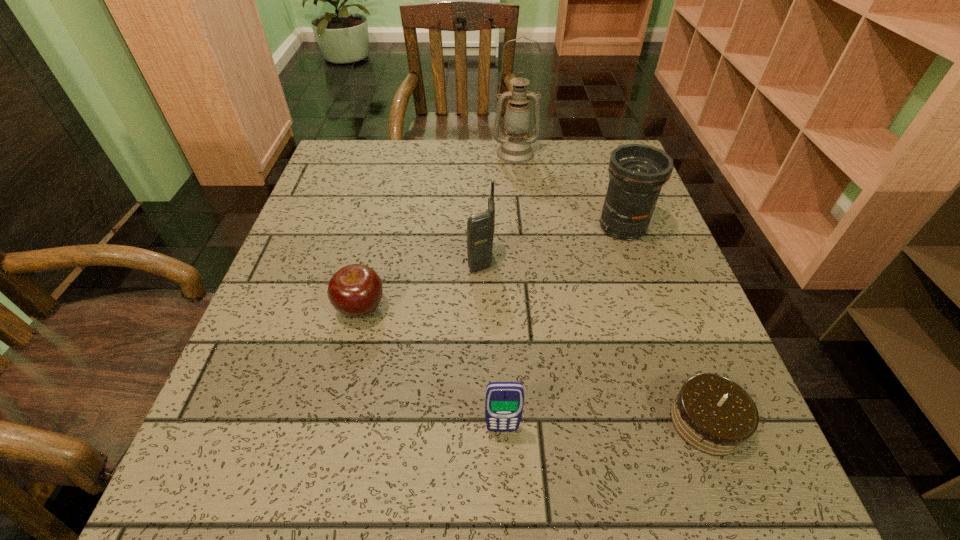
Where is `the farthest object`? The height and width of the screenshot is (540, 960). the farthest object is located at coordinates (516, 148).

I want to click on the tallest object, so click(x=516, y=148).

At what (x,y) coordinates should I click in order to perform the action: click on the second farthest object. Please return your answer as a coordinate pair (x, y). The image size is (960, 540). Looking at the image, I should click on (637, 172).

Locate an element on the screen. The width and height of the screenshot is (960, 540). the fourth nearest object is located at coordinates (480, 227).

Locate an element on the screen. The image size is (960, 540). the taller cellular telephone is located at coordinates (480, 227).

I want to click on the nearer cellular telephone, so click(x=504, y=401).

In order to click on the third shortest object in this screenshot , I will do `click(504, 401)`.

Find the location of a particular element. apple is located at coordinates pyautogui.click(x=355, y=290).

You are a GUI agent. You are given a task and a screenshot of the screen. Output one action in this format:
    pyautogui.click(x=<x>, y=<y>)
    Task: Click on the fifth tallest object
    This screenshot has height=540, width=960.
    Given the screenshot: What is the action you would take?
    pyautogui.click(x=355, y=290)

This screenshot has height=540, width=960. Find the location of `the shortest object`. the shortest object is located at coordinates (714, 415).